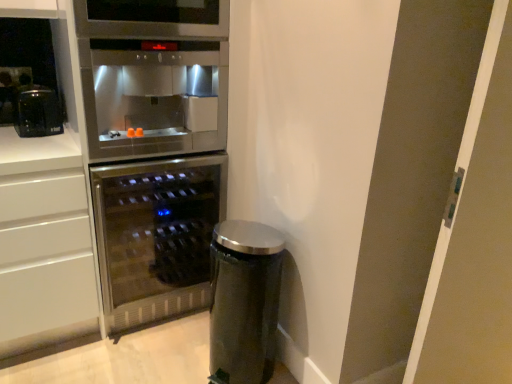
What is the approximate height of stainless steel oven at upper center?

The height of stainless steel oven at upper center is 24.83 inches.

Measure the distance between point (x=447, y=364) and camera.

Point (x=447, y=364) is 4.88 feet from camera.

The image size is (512, 384). Describe the element at coordinates (156, 236) in the screenshot. I see `stainless steel wine cooler at center` at that location.

Locate an element on the screen. stainless steel oven at upper center is located at coordinates (150, 97).

Is stainless steel oven at upper center further to the viewer compared to matte black coffee maker at upper left?

That is False.

Which point is more distant from viewer, (x=207, y=53) or (x=42, y=136)?

Point (x=42, y=136)

Considering the sizes of objects stainless steel oven at upper center and matte black coffee maker at upper left in the image provided, who is taller, stainless steel oven at upper center or matte black coffee maker at upper left?

stainless steel oven at upper center.

Which object is thinner, stainless steel oven at upper center or matte black coffee maker at upper left?

Thinner between the two is matte black coffee maker at upper left.

Is matte black coffee maker at upper left taller or shorter than transparent glass door at right?

matte black coffee maker at upper left is shorter than transparent glass door at right.

In the scene shown: From the image's perspective, between matte black coffee maker at upper left and transparent glass door at right, who is located below?

transparent glass door at right, from the image's perspective.

Is matte black coffee maker at upper left closer to the viewer compared to transparent glass door at right?

No.

Is matte black coffee maker at upper left looking in the opposite direction of transparent glass door at right?

No, matte black coffee maker at upper left is not facing the opposite direction of transparent glass door at right.

In the scene shown: Does stainless steel wine cooler at center appear on the left side of transparent glass door at right?

Yes, stainless steel wine cooler at center is to the left of transparent glass door at right.

I want to click on home appliance on the left side of transparent glass door at right, so click(x=156, y=236).

What's the angular difference between stainless steel wine cooler at center and transparent glass door at right's facing directions?

10.6 degrees.

Between stainless steel wine cooler at center and transparent glass door at right, which one has smaller width?

Thinner between the two is transparent glass door at right.

From a real-world perspective, is stainless steel fridge at center physically located above or below stainless steel wine cooler at center?

Clearly, from a real-world perspective, stainless steel fridge at center is above stainless steel wine cooler at center.

Consider the image. Is stainless steel fridge at center oriented away from stainless steel wine cooler at center?

Correct, stainless steel fridge at center is looking away from stainless steel wine cooler at center.

From the image's perspective, is stainless steel fridge at center located above or below stainless steel wine cooler at center?

stainless steel fridge at center is above stainless steel wine cooler at center.

How many degrees apart are the facing directions of stainless steel fridge at center and stainless steel wine cooler at center?

0.00268 degrees.

From the image's perspective, which is above, stainless steel oven at upper center or satin silver trash can at lower right?

stainless steel oven at upper center.

From a real-world perspective, which is physically below, stainless steel oven at upper center or satin silver trash can at lower right?

In real-world perspective, satin silver trash can at lower right is lower.

Who is smaller, stainless steel oven at upper center or satin silver trash can at lower right?

Smaller between the two is satin silver trash can at lower right.

Considering the positions of point (215, 143) and point (242, 361), is point (215, 143) closer or farther from the camera than point (242, 361)?

Point (215, 143) is positioned farther from the camera compared to point (242, 361).

From the image's perspective, which is below, transparent glass door at right or matte black coffee maker at upper left?

transparent glass door at right appears lower in the image.

Is the position of transparent glass door at right more distant than that of matte black coffee maker at upper left?

No, transparent glass door at right is closer to the viewer.

Who is shorter, transparent glass door at right or matte black coffee maker at upper left?

matte black coffee maker at upper left.

Is transparent glass door at right facing away from matte black coffee maker at upper left?

transparent glass door at right does not have its back to matte black coffee maker at upper left.

How far apart are matte black coffee maker at upper left and satin silver trash can at lower right?

matte black coffee maker at upper left is 3.42 feet away from satin silver trash can at lower right.

From the image's perspective, is matte black coffee maker at upper left located above satin silver trash can at lower right?

Yes, from the image's perspective, matte black coffee maker at upper left is over satin silver trash can at lower right.

Considering the sizes of objects matte black coffee maker at upper left and satin silver trash can at lower right in the image provided, who is smaller, matte black coffee maker at upper left or satin silver trash can at lower right?

Smaller between the two is matte black coffee maker at upper left.

Is matte black coffee maker at upper left outside of satin silver trash can at lower right?

Yes.

Identify the location of kitchen appliance on the left of stainless steel oven at upper center. The height and width of the screenshot is (384, 512). (38, 113).

You are a GUI agent. You are given a task and a screenshot of the screen. Output one action in this format:
    pyautogui.click(x=<x>, y=<y>)
    Task: Click on the glass door below the matte black coffee maker at upper left (from the image's perspective)
    Image resolution: width=512 pixels, height=384 pixels.
    Given the screenshot: What is the action you would take?
    pyautogui.click(x=475, y=239)

Estimate the real-world distances between objects in this image. Which object is closer to stainless steel wine cooler at center, matte black coffee maker at upper left or transparent glass door at right?

matte black coffee maker at upper left is positioned closer to the anchor stainless steel wine cooler at center.

When comparing their distances from satin silver trash can at lower right, does stainless steel wine cooler at center or stainless steel oven at upper center seem further?

The object further to satin silver trash can at lower right is stainless steel oven at upper center.

When comparing their distances from satin silver trash can at lower right, does stainless steel fridge at center or transparent glass door at right seem further?

The object further to satin silver trash can at lower right is transparent glass door at right.

From the image, which object appears to be nearer to stainless steel fridge at center, matte black coffee maker at upper left or transparent glass door at right?

Based on the image, matte black coffee maker at upper left appears to be nearer to stainless steel fridge at center.

Looking at the image, which one is located further to satin silver trash can at lower right, stainless steel oven at upper center or stainless steel fridge at center?

stainless steel oven at upper center.

Looking at the image, which one is located closer to matte black coffee maker at upper left, satin silver trash can at lower right or transparent glass door at right?

satin silver trash can at lower right lies closer to matte black coffee maker at upper left than the other object.

Based on their spatial positions, is transparent glass door at right or satin silver trash can at lower right further from stainless steel fridge at center?

transparent glass door at right is further to stainless steel fridge at center.

Based on their spatial positions, is transparent glass door at right or satin silver trash can at lower right closer to stainless steel oven at upper center?

satin silver trash can at lower right is positioned closer to the anchor stainless steel oven at upper center.

Identify the location of oven between stainless steel fridge at center and transparent glass door at right. This screenshot has height=384, width=512. (150, 97).

You are a GUI agent. You are given a task and a screenshot of the screen. Output one action in this format:
    pyautogui.click(x=<x>, y=<y>)
    Task: Click on the home appliance located between matte black coffee maker at upper left and satin silver trash can at lower right in the left-right direction
    
    Given the screenshot: What is the action you would take?
    pyautogui.click(x=156, y=236)

I want to click on appliance between stainless steel fridge at center and transparent glass door at right from left to right, so click(244, 301).

Find the location of a particular element. home appliance that lies between stainless steel oven at upper center and satin silver trash can at lower right from top to bottom is located at coordinates (156, 236).